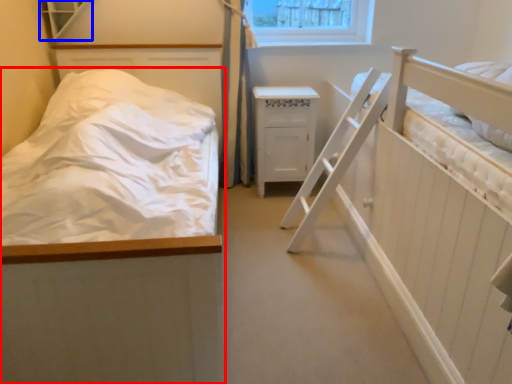
Question: Which point is further to the camera, bed (highlighted by a red box) or window (highlighted by a blue box)?

Choices:
 (A) bed
 (B) window

Answer: (B)